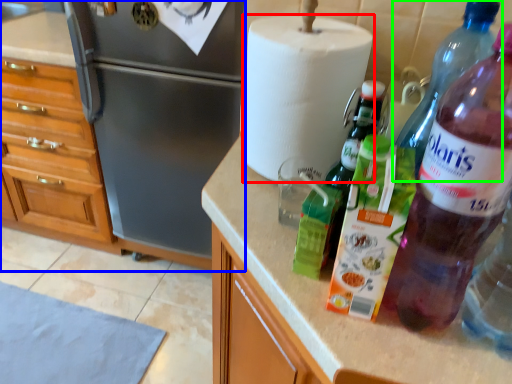
Question: Which object is the closest to the paper towel (highlighted by a red box)? Choose among these: cabinetry (highlighted by a blue box) or bottle (highlighted by a green box).

Choices:
 (A) cabinetry
 (B) bottle

Answer: (B)